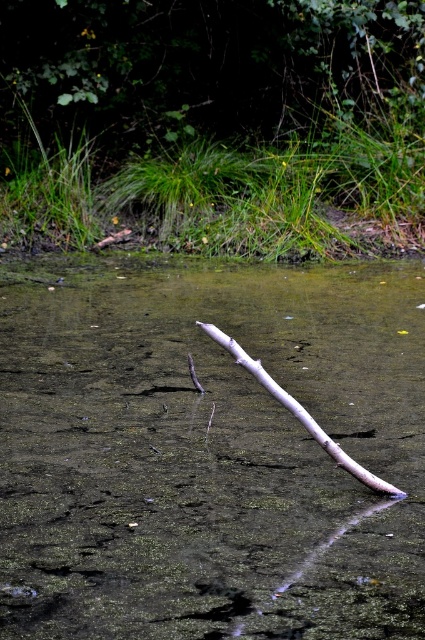
You are a small frog trying to jump from a rock to the other side of the water. You see clear water at center and a smooth gray stick at center. Which object can you land on first?

The smooth gray stick at center can be landed on first because it is smaller in size compared to the clear water at center, allowing the frog to reach it sooner.